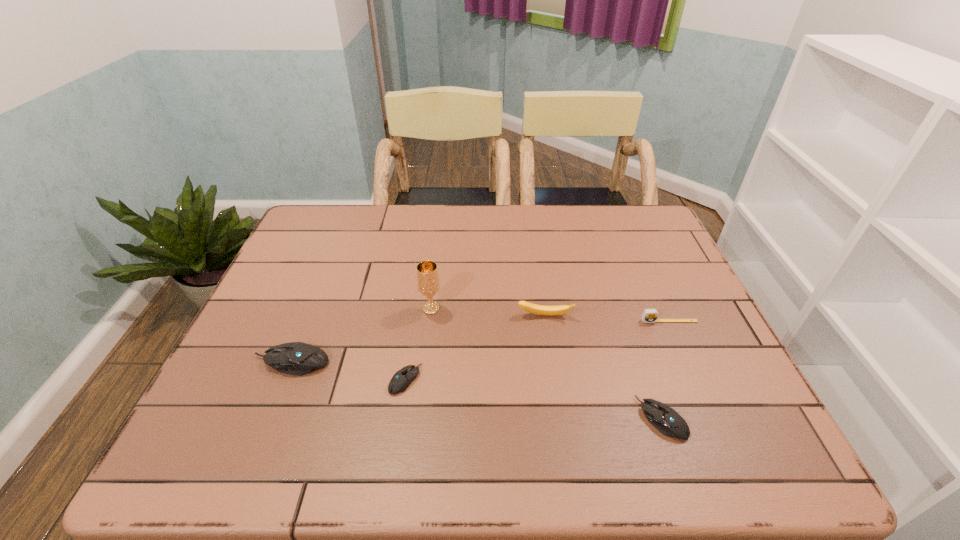
Locate an element on the screen. This screenshot has width=960, height=540. free space located on the right of the leftmost object is located at coordinates (395, 362).

I want to click on free space located on the back of the shortest computer mouse, so click(424, 258).

Image resolution: width=960 pixels, height=540 pixels. Find the location of `vacant point located 0.380m on the left of the rightmost computer mouse`. vacant point located 0.380m on the left of the rightmost computer mouse is located at coordinates (454, 418).

Where is `vacant region located 0.370m on the back of the chalice`? vacant region located 0.370m on the back of the chalice is located at coordinates (441, 222).

Identify the location of vacant space located at the front of the tape measure with the tape extended. This screenshot has width=960, height=540. (692, 373).

At what (x,y) coordinates should I click in order to perform the action: click on free location located at the stem of the banana. Please return your answer as a coordinate pair (x, y). Looking at the image, I should click on (558, 399).

Locate an element on the screen. This screenshot has height=540, width=960. object that is at the left edge is located at coordinates (296, 358).

You are a GUI agent. You are given a task and a screenshot of the screen. Output one action in this format:
    pyautogui.click(x=<x>, y=<y>)
    Task: Click on the computer mouse situated at the right edge
    
    Given the screenshot: What is the action you would take?
    [x=665, y=419]

Where is `tape measure at the right edge`? The image size is (960, 540). tape measure at the right edge is located at coordinates (649, 315).

At what (x,y) coordinates should I click in order to perform the action: click on object that is at the near right corner. Please return your answer as a coordinate pair (x, y). The width and height of the screenshot is (960, 540). Looking at the image, I should click on (665, 419).